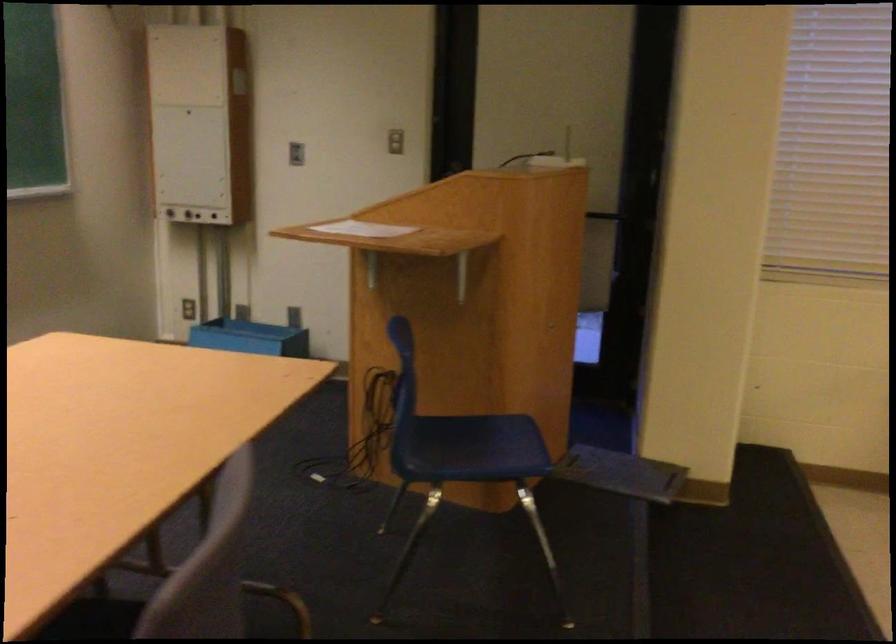
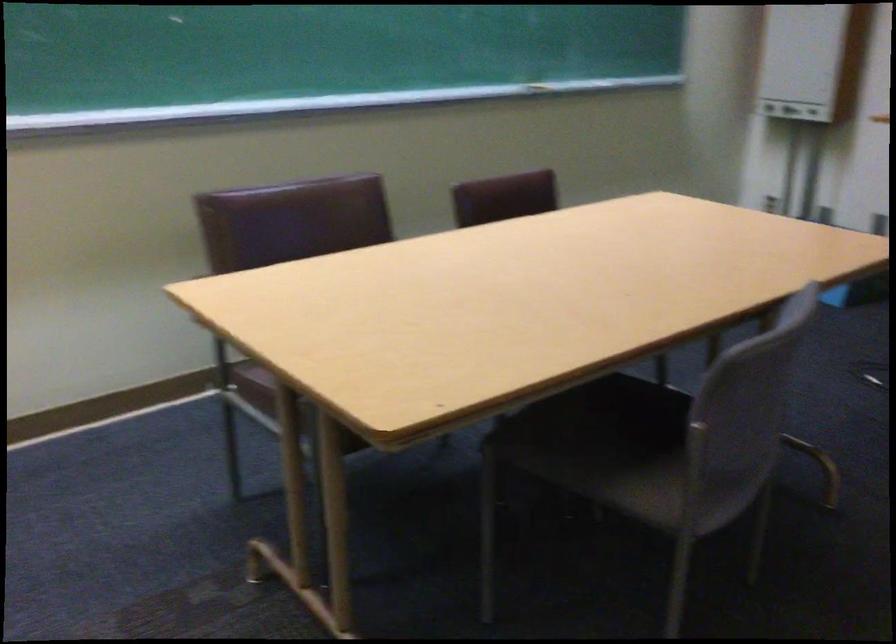
Question: How did the camera likely rotate?

Choices:
 (A) Left
 (B) Right
 (C) Up
 (D) Down

Answer: (A)